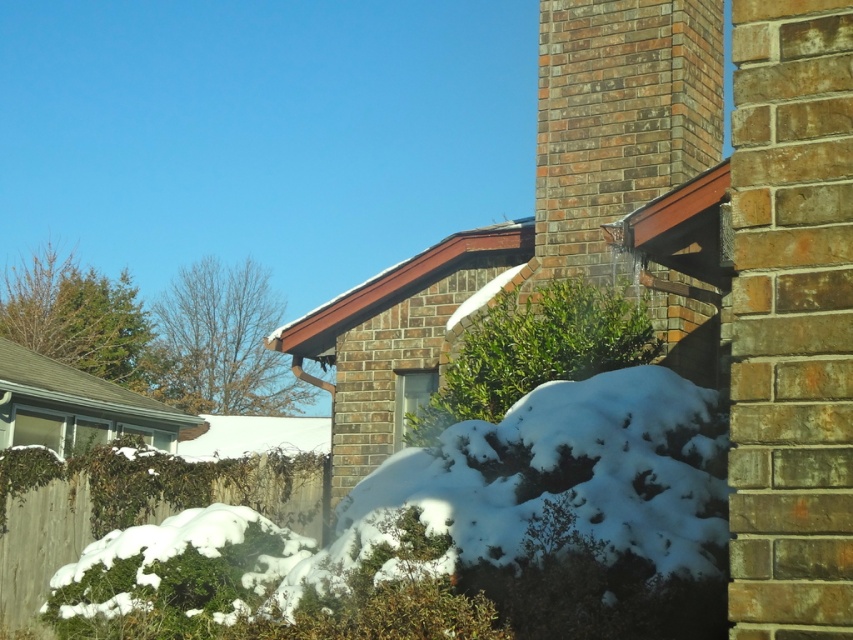
Who is shorter, white fluffy snow at lower center or brick chimney at upper right?

white fluffy snow at lower center is shorter.

Can you confirm if white fluffy snow at lower center is positioned to the left of brick chimney at upper right?

Indeed, white fluffy snow at lower center is positioned on the left side of brick chimney at upper right.

Is point (317, 598) less distant than point (576, 104)?

Yes, it is.

What are the coordinates of `white fluffy snow at lower center` in the screenshot? It's located at (462, 529).